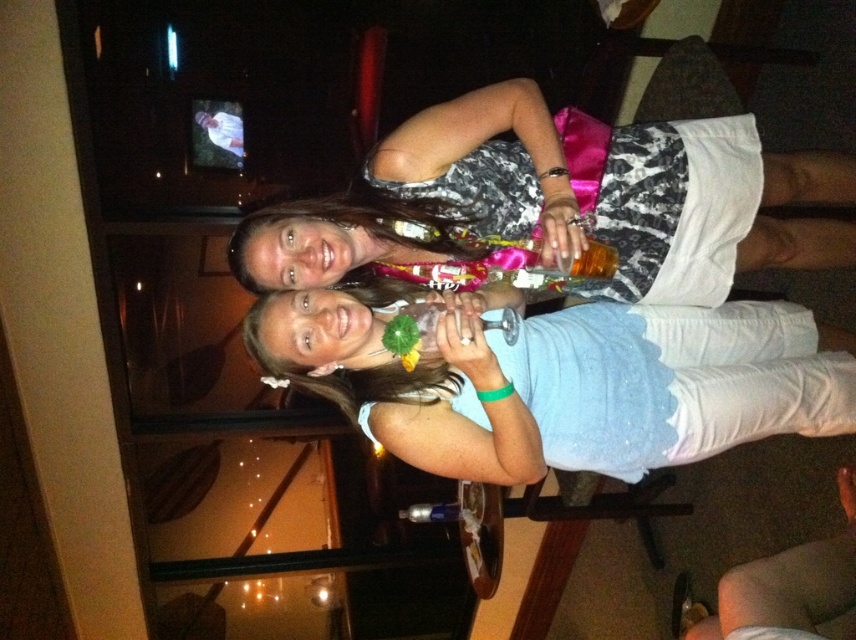
Is point (788, 412) positioned after point (742, 192)?

Yes, point (788, 412) is behind point (742, 192).

Can you confirm if white matte dress at center is positioned to the right of matte black dress at center?

Incorrect, white matte dress at center is not on the right side of matte black dress at center.

Locate an element on the screen. The width and height of the screenshot is (856, 640). white matte dress at center is located at coordinates pyautogui.click(x=565, y=381).